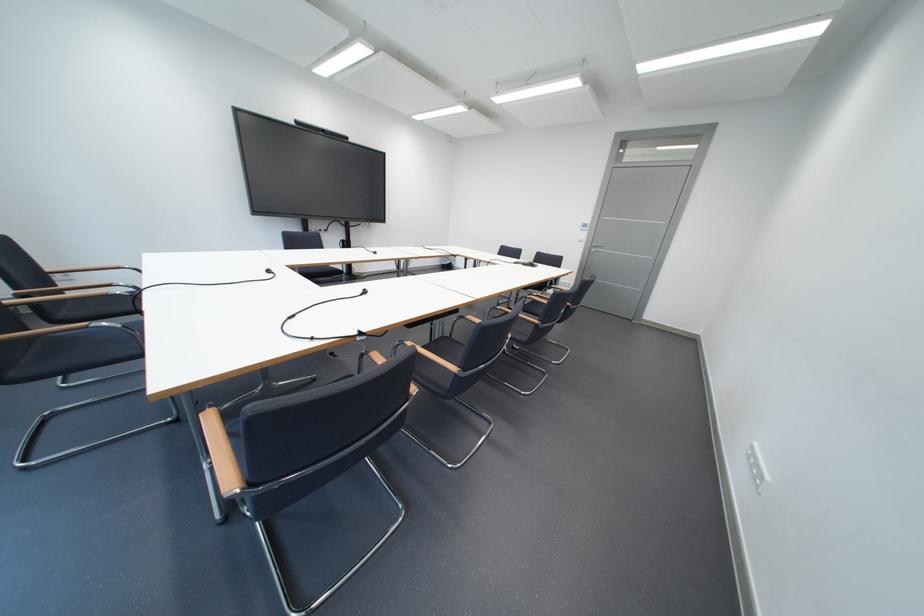
Identify the location of white wall switch. This screenshot has width=924, height=616. (757, 467).